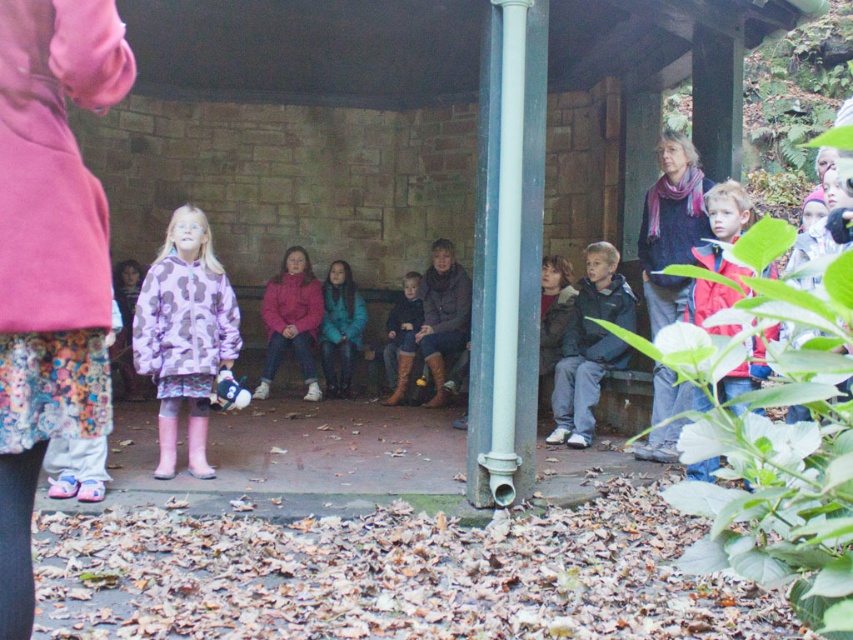
Question: Does red matte jacket at right have a larger size compared to matte teal sweater at center?

Choices:
 (A) yes
 (B) no

Answer: (A)

Question: Which point is farther to the camera?

Choices:
 (A) [351, 307]
 (B) [683, 170]

Answer: (A)

Question: Among these objects, which one is nearest to the camera?

Choices:
 (A) dark blue sweater at right
 (B) floral skirt at lower left
 (C) matte black boots at center
 (D) purple printed jacket at center

Answer: (B)

Question: Does floral skirt at lower left have a lesser width compared to red matte jacket at right?

Choices:
 (A) yes
 (B) no

Answer: (A)

Question: Estimate the real-world distances between objects in this image. Which object is farther from the dark blue sweater at right?

Choices:
 (A) purple printed jacket at center
 (B) matte black boots at center
 (C) dark blue jacket at center
 (D) floral skirt at lower left

Answer: (D)

Question: In this image, where is dark blue jacket at center located relative to matte teal sweater at center?

Choices:
 (A) right
 (B) left

Answer: (A)